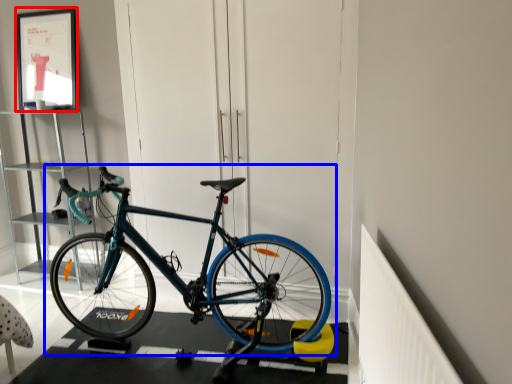
Question: Which point is closer to the camera, picture frame (highlighted by a red box) or bicycle (highlighted by a blue box)?

Choices:
 (A) picture frame
 (B) bicycle

Answer: (B)